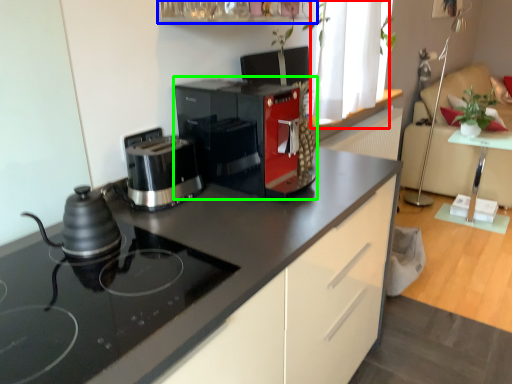
Question: Estimate the real-world distances between objects in this image. Which object is closer to window (highlighted by a red box), shelf (highlighted by a blue box) or coffee maker (highlighted by a green box)?

Choices:
 (A) shelf
 (B) coffee maker

Answer: (A)